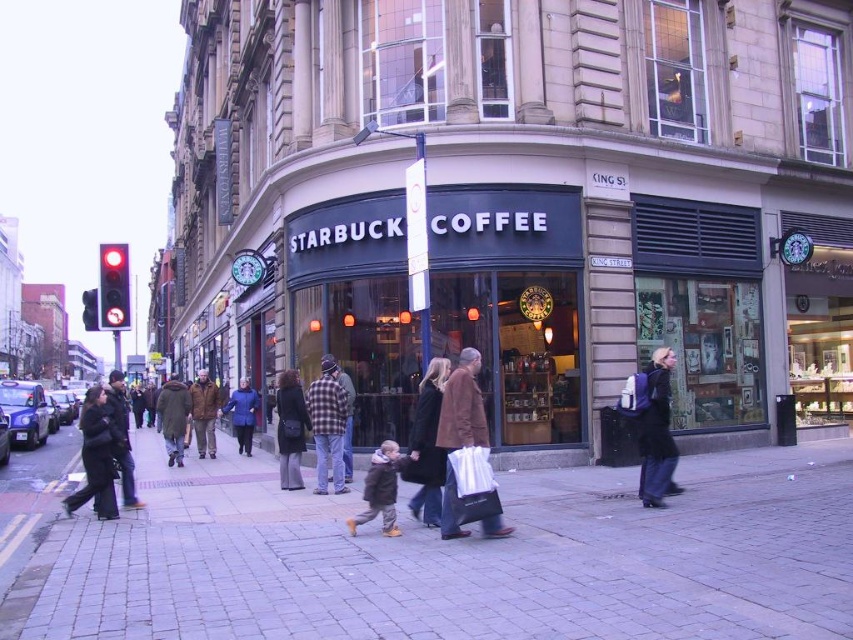
Question: Does brown fuzzy coat at center appear on the right side of dark blue coat at center?

Choices:
 (A) no
 (B) yes

Answer: (B)

Question: Which object appears closest to the camera in this image?

Choices:
 (A) dark brown leather coat at lower left
 (B) plaid fabric jacket at center

Answer: (A)

Question: Which of the following is the closest to the observer?

Choices:
 (A) brown woolen jacket at center
 (B) matte black coffee shop at center
 (C) plaid fabric jacket at center

Answer: (C)

Question: Does dark brown leather coat at lower left appear over dark brown leather jacket at lower left?

Choices:
 (A) no
 (B) yes

Answer: (B)

Question: From the image, what is the correct spatial relationship of plaid fabric jacket at center in relation to dark gray fabric coat at center?

Choices:
 (A) left
 (B) right

Answer: (B)

Question: Among these objects, which one is farthest from the camera?

Choices:
 (A) dark brown coat at center
 (B) brown woolen jacket at center
 (C) brown fuzzy coat at center

Answer: (B)